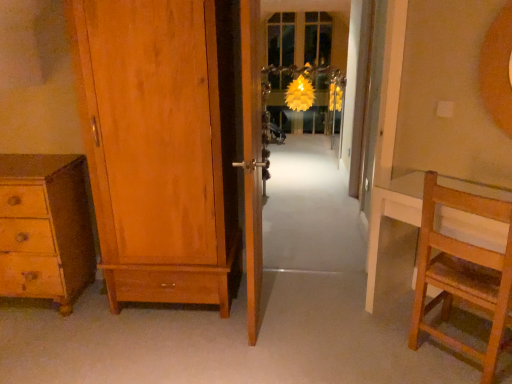
In order to face wooden floor at center, the first path when ordered from bottom to top, should I rotate leftwards or rightwards?

Rotate left and turn 3.832 degrees.

Describe the element at coordinates (310, 211) in the screenshot. The image size is (512, 384). I see `white carpet at center, which is counted as the 2th path, starting from the front` at that location.

Where is `white carpet at center, which appears as the 1th path when viewed from the back`? white carpet at center, which appears as the 1th path when viewed from the back is located at coordinates pyautogui.click(x=310, y=211).

This screenshot has width=512, height=384. Describe the element at coordinates (258, 136) in the screenshot. I see `translucent glass screen door at center` at that location.

What are the coordinates of `light brown wooden chair at right` in the screenshot? It's located at (463, 273).

Which of these two, white carpet at center, which is the 2th path from bottom to top, or wooden door at center, the 1th door in the right-to-left sequence, stands taller?

wooden door at center, the 1th door in the right-to-left sequence.

Is point (312, 219) closer or farther from the camera than point (252, 260)?

Clearly, point (312, 219) is more distant from the camera than point (252, 260).

From the image's perspective, is white carpet at center, which is the 2th path from bottom to top, located above or below wooden door at center, the 1th door in the right-to-left sequence?

white carpet at center, which is the 2th path from bottom to top, is above wooden door at center, the 1th door in the right-to-left sequence.

Which of these two, white carpet at center, which is counted as the 2th path, starting from the front, or wooden door at center, acting as the second door starting from the left, is thinner?

Thinner between the two is wooden door at center, acting as the second door starting from the left.

Considering the relative sizes of wooden door at center, the 1th door in the right-to-left sequence, and wooden floor at center, arranged as the 2th path when viewed from the back, in the image provided, is wooden door at center, the 1th door in the right-to-left sequence, bigger than wooden floor at center, arranged as the 2th path when viewed from the back,?

Yes.

Is point (245, 145) closer to camera compared to point (41, 370)?

No, it is not.

From a real-world perspective, does wooden door at center, acting as the second door starting from the left, sit lower than wooden floor at center, the first path when ordered from bottom to top?

No.

Is wooden door at center, the 1th door in the right-to-left sequence, oriented towards wooden floor at center, arranged as the 2th path when viewed from the back?

No, wooden door at center, the 1th door in the right-to-left sequence, is not aimed at wooden floor at center, arranged as the 2th path when viewed from the back.

Is translucent glass screen door at center next to wooden door at center, acting as the second door starting from the left, and touching it?

No, translucent glass screen door at center is not beside wooden door at center, acting as the second door starting from the left.

Considering the sizes of objects translucent glass screen door at center and wooden door at center, the 1th door in the right-to-left sequence, in the image provided, who is wider, translucent glass screen door at center or wooden door at center, the 1th door in the right-to-left sequence,?

With larger width is wooden door at center, the 1th door in the right-to-left sequence.

From the image's perspective, which one is positioned lower, translucent glass screen door at center or wooden door at center, acting as the second door starting from the left?

wooden door at center, acting as the second door starting from the left.

Which object is positioned more to the left, wooden chest of drawers at lower left or translucent glass screen door at center?

Positioned to the left is wooden chest of drawers at lower left.

Is wooden chest of drawers at lower left outside of translucent glass screen door at center?

wooden chest of drawers at lower left lies outside translucent glass screen door at center's area.

Looking at their sizes, would you say wooden chest of drawers at lower left is wider or thinner than translucent glass screen door at center?

wooden chest of drawers at lower left is wider than translucent glass screen door at center.

Is wooden chest of drawers at lower left turned away from translucent glass screen door at center?

No, wooden chest of drawers at lower left is not facing away from translucent glass screen door at center.

Does point (318, 160) appear closer or farther from the camera than point (251, 70)?

Point (318, 160) is farther from the camera than point (251, 70).

From the picture: How different are the orientations of white carpet at center, which appears as the 1th path when viewed from the back, and translucent glass screen door at center in degrees?

white carpet at center, which appears as the 1th path when viewed from the back, and translucent glass screen door at center are facing 0.0315 degrees away from each other.

Is white carpet at center, the first path from the top, taller than translucent glass screen door at center?

In fact, white carpet at center, the first path from the top, may be shorter than translucent glass screen door at center.

Considering the relative positions of white carpet at center, which is counted as the 2th path, starting from the front, and translucent glass screen door at center in the image provided, is white carpet at center, which is counted as the 2th path, starting from the front, in front of translucent glass screen door at center?

No.

From a real-world perspective, relative to wooden chest of drawers at lower left, is wooden door at center, the 1th door in the right-to-left sequence, vertically above or below?

In terms of real-world spatial position, wooden door at center, the 1th door in the right-to-left sequence, is above wooden chest of drawers at lower left.

Can you see wooden door at center, acting as the second door starting from the left, touching wooden chest of drawers at lower left?

wooden door at center, acting as the second door starting from the left, and wooden chest of drawers at lower left are clearly separated.

From the image's perspective, which one is positioned lower, wooden door at center, acting as the second door starting from the left, or wooden chest of drawers at lower left?

wooden chest of drawers at lower left.

Can you confirm if wooden door at center, acting as the second door starting from the left, is taller than wooden chest of drawers at lower left?

Indeed, wooden door at center, acting as the second door starting from the left, has a greater height compared to wooden chest of drawers at lower left.

Based on their sizes in the image, would you say wooden door at center, acting as the second door starting from the left, is bigger or smaller than matte wood wardrobe at left, which is the first door in left-to-right order?

wooden door at center, acting as the second door starting from the left, is smaller than matte wood wardrobe at left, which is the first door in left-to-right order.

How distant is wooden door at center, acting as the second door starting from the left, from matte wood wardrobe at left, which appears as the 2th door when viewed from the right?

The distance of wooden door at center, acting as the second door starting from the left, from matte wood wardrobe at left, which appears as the 2th door when viewed from the right, is 42.99 centimeters.

Considering the points (254, 203) and (88, 35), which point is behind, point (254, 203) or point (88, 35)?

The point (254, 203) is behind.

Is wooden door at center, acting as the second door starting from the left, situated inside matte wood wardrobe at left, which appears as the 2th door when viewed from the right, or outside?

wooden door at center, acting as the second door starting from the left, cannot be found inside matte wood wardrobe at left, which appears as the 2th door when viewed from the right.

The image size is (512, 384). In order to click on the 2nd door in front of the white carpet at center, which is the 2th path from bottom to top, counting from the anchor's position in this screenshot , I will do `click(252, 155)`.

The image size is (512, 384). I want to click on door on the right of wooden floor at center, arranged as the 2th path when viewed from the back, so click(252, 155).

When comparing their distances from wooden chest of drawers at lower left, does translucent glass screen door at center or wooden door at center, acting as the second door starting from the left, seem closer?

wooden door at center, acting as the second door starting from the left.

Considering their positions, is white carpet at center, which appears as the 1th path when viewed from the back, positioned closer to translucent glass screen door at center than wooden chest of drawers at lower left?

wooden chest of drawers at lower left lies closer to translucent glass screen door at center than the other object.

Looking at the image, which one is located further to translucent glass screen door at center, wooden door at center, the 1th door in the right-to-left sequence, or white carpet at center, which is the 2th path from bottom to top?

The object further to translucent glass screen door at center is white carpet at center, which is the 2th path from bottom to top.

Which object lies nearer to the anchor point wooden floor at center, the second path when ordered from top to bottom, light brown wooden chair at right or translucent glass screen door at center?

Based on the image, light brown wooden chair at right appears to be nearer to wooden floor at center, the second path when ordered from top to bottom.

From the image, which object appears to be farther from white carpet at center, which is the 2th path from bottom to top, wooden door at center, acting as the second door starting from the left, or wooden chest of drawers at lower left?

The object further to white carpet at center, which is the 2th path from bottom to top, is wooden chest of drawers at lower left.

In the scene shown: Which object lies nearer to the anchor point wooden chest of drawers at lower left, matte wood wardrobe at left, which is the first door in left-to-right order, or wooden door at center, acting as the second door starting from the left?

matte wood wardrobe at left, which is the first door in left-to-right order, is positioned closer to the anchor wooden chest of drawers at lower left.

Which object lies nearer to the anchor point matte wood wardrobe at left, which appears as the 2th door when viewed from the right, light brown wooden chair at right or wooden floor at center, the second path when ordered from top to bottom?

The object closer to matte wood wardrobe at left, which appears as the 2th door when viewed from the right, is wooden floor at center, the second path when ordered from top to bottom.

Estimate the real-world distances between objects in this image. Which object is further from matte wood wardrobe at left, which appears as the 2th door when viewed from the right, wooden door at center, acting as the second door starting from the left, or wooden chest of drawers at lower left?

wooden chest of drawers at lower left lies further to matte wood wardrobe at left, which appears as the 2th door when viewed from the right, than the other object.

Where is `door located between wooden floor at center, arranged as the 2th path when viewed from the back, and light brown wooden chair at right in the left-right direction`? door located between wooden floor at center, arranged as the 2th path when viewed from the back, and light brown wooden chair at right in the left-right direction is located at coordinates (252, 155).

What are the coordinates of `screen door situated between matte wood wardrobe at left, which is the first door in left-to-right order, and white carpet at center, which is counted as the 2th path, starting from the front, from left to right` in the screenshot? It's located at pyautogui.click(x=258, y=136).

What are the coordinates of `door situated between matte wood wardrobe at left, which appears as the 2th door when viewed from the right, and light brown wooden chair at right from left to right` in the screenshot? It's located at (252, 155).

Identify the location of screen door situated between wooden floor at center, the first path when ordered from bottom to top, and light brown wooden chair at right from left to right. (258, 136).